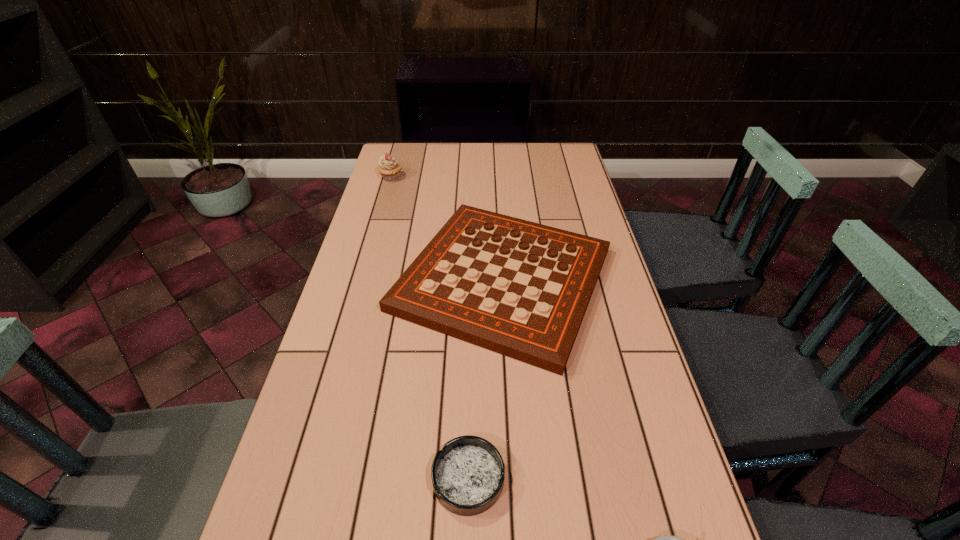
Where is `free space between the left ashtray and the third nearest object`? The height and width of the screenshot is (540, 960). free space between the left ashtray and the third nearest object is located at coordinates (486, 379).

Identify which object is located as the nearest to the tallest object. Please provide its 2D coordinates. Your answer should be formatted as a tuple, i.e. [(x, y)], where the tuple contains the x and y coordinates of a point satisfying the conditions above.

[(521, 289)]

Locate which object is the third closest to the gameboard. Please provide its 2D coordinates. Your answer should be formatted as a tuple, i.e. [(x, y)], where the tuple contains the x and y coordinates of a point satisfying the conditions above.

[(666, 539)]

You are a GUI agent. You are given a task and a screenshot of the screen. Output one action in this format:
    pyautogui.click(x=<x>, y=<y>)
    Task: Click on the free location that satisfies the following two spatial constraints: 1. on the front side of the leftmost object; 2. on the right side of the third shortest object
    The height and width of the screenshot is (540, 960).
    Given the screenshot: What is the action you would take?
    pyautogui.click(x=362, y=280)